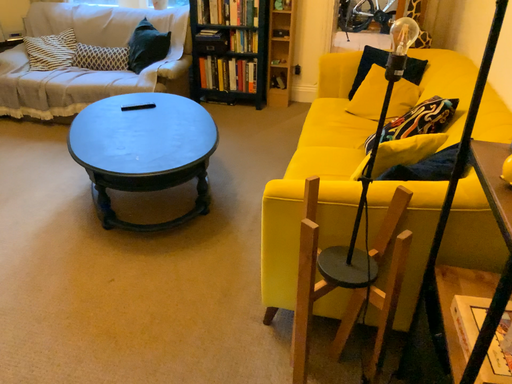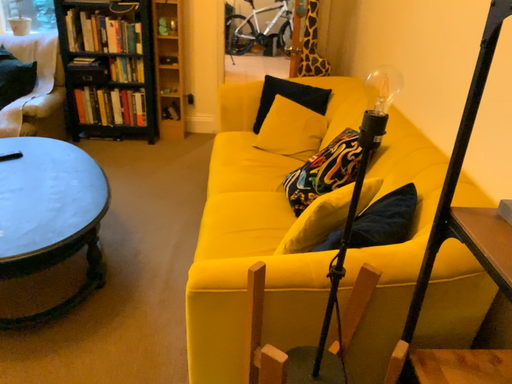
Question: How did the camera likely rotate when shooting the video?

Choices:
 (A) rotated left
 (B) rotated right

Answer: (B)